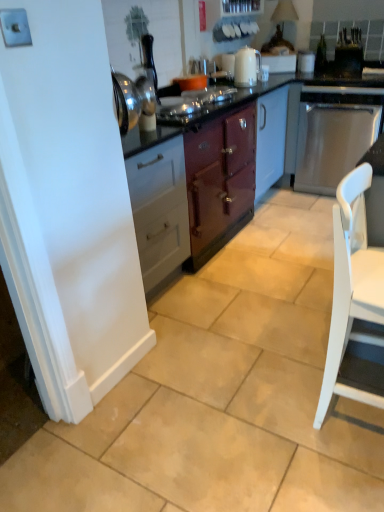
Locate an element on the screen. The width and height of the screenshot is (384, 512). blank space to the left of white matte chair at lower right is located at coordinates (281, 392).